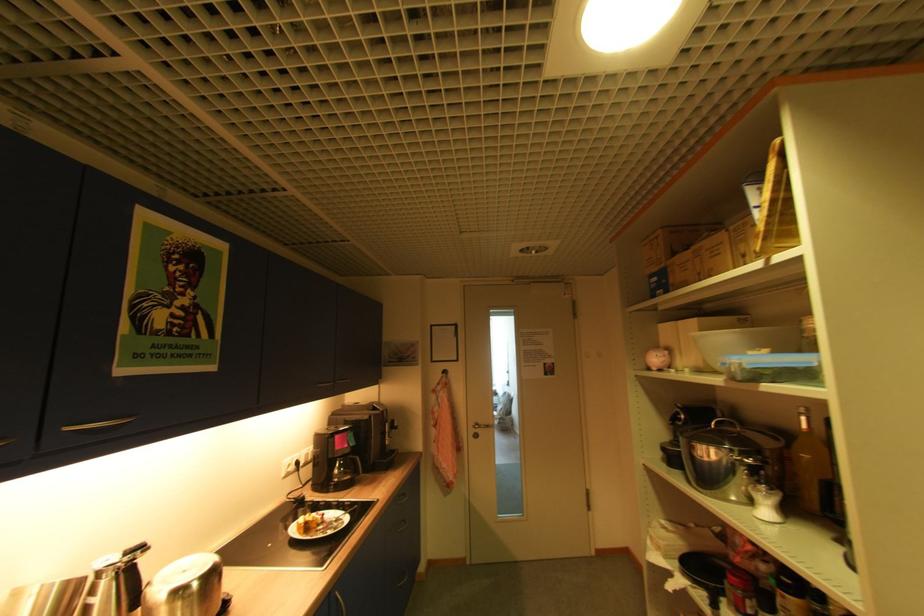
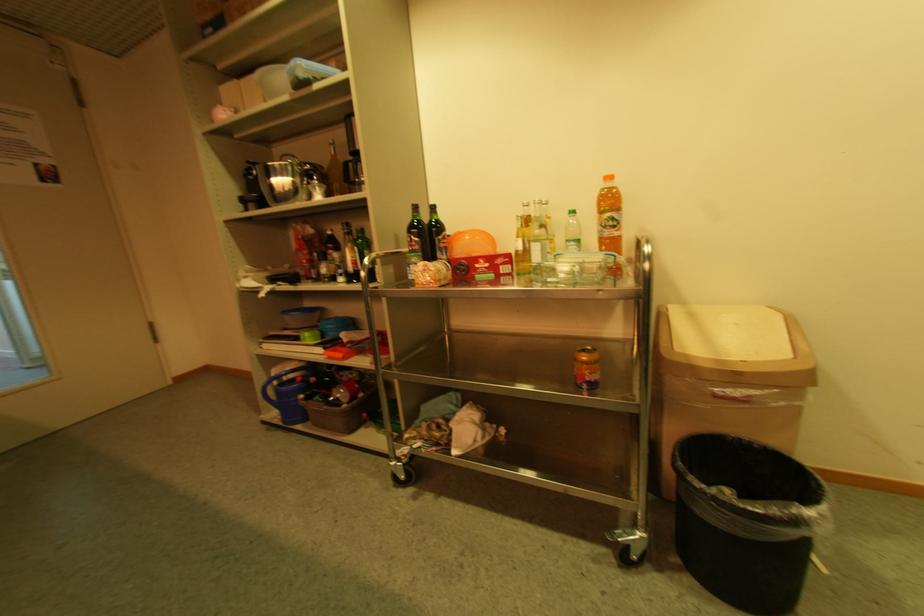
Question: The first image is from the beginning of the video and the second image is from the end. How did the camera likely rotate when shooting the video?

Choices:
 (A) Left
 (B) Right
 (C) Up
 (D) Down

Answer: (B)